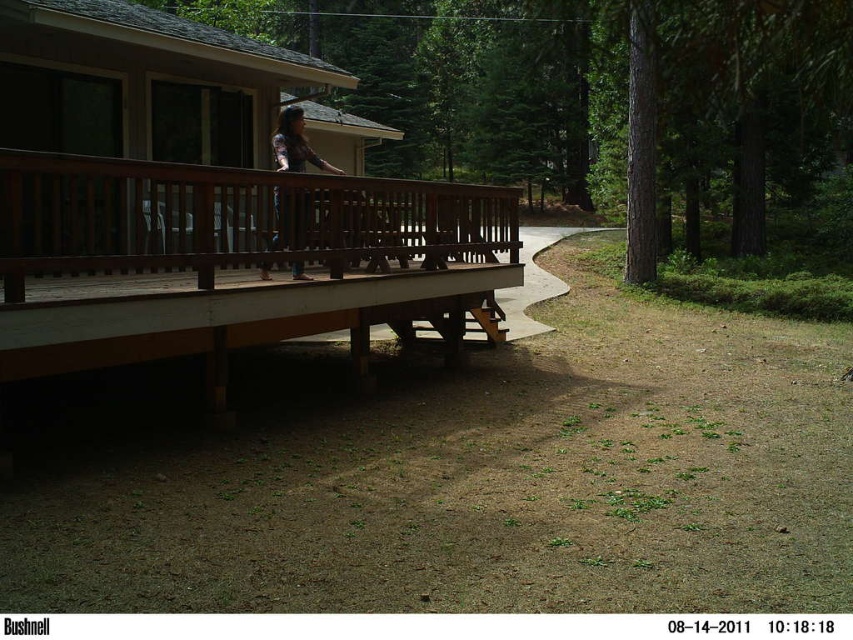
Does brown wooden porch at upper left have a greater height compared to brown wooden cabin at upper left?

Incorrect, brown wooden porch at upper left's height is not larger of brown wooden cabin at upper left's.

Which is more to the right, brown wooden porch at upper left or brown wooden cabin at upper left?

Positioned to the right is brown wooden porch at upper left.

Identify the location of brown wooden porch at upper left. This screenshot has height=640, width=853. (231, 257).

Which of these two, brown wooden porch at upper left or matte brown hair at center, stands shorter?

With less height is brown wooden porch at upper left.

Which is behind, point (219, 250) or point (283, 189)?

The point (283, 189) is more distant.

Does point (360, 280) come farther from viewer compared to point (287, 205)?

Yes.

Image resolution: width=853 pixels, height=640 pixels. Find the location of `brown wooden porch at upper left`. brown wooden porch at upper left is located at coordinates coord(231,257).

Can you confirm if brown wooden cabin at upper left is shorter than matte brown hair at center?

Incorrect, brown wooden cabin at upper left's height does not fall short of matte brown hair at center's.

Is brown wooden cabin at upper left thinner than matte brown hair at center?

No.

This screenshot has height=640, width=853. I want to click on brown wooden cabin at upper left, so click(x=143, y=83).